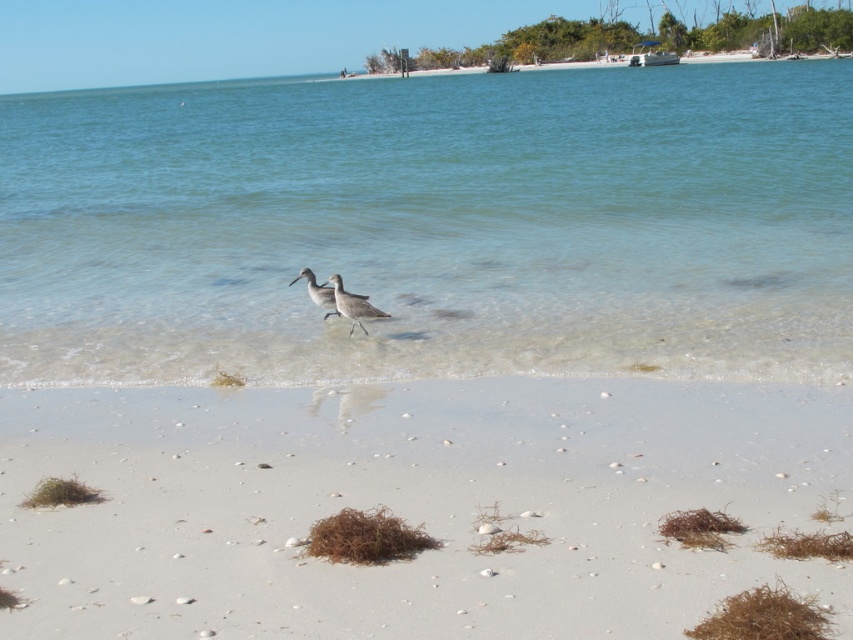
Who is positioned more to the left, brown speckled sandpiper at center or gray matte bird at center?

Positioned to the left is gray matte bird at center.

Which is behind, point (339, 282) or point (332, 301)?

The point (332, 301) is behind.

Is point (351, 314) positioned in front of point (323, 288)?

That is True.

Locate an element on the screen. brown speckled sandpiper at center is located at coordinates (352, 305).

Who is higher up, white sandy beach at lower center or brown speckled sandpiper at center?

Positioned higher is brown speckled sandpiper at center.

Between point (492, 380) and point (338, 305), which one is positioned in front?

Point (492, 380) is in front.

The width and height of the screenshot is (853, 640). I want to click on white sandy beach at lower center, so click(x=412, y=506).

Which is more to the left, clear water at center or gray matte bird at center?

Positioned to the left is clear water at center.

Between point (677, 260) and point (361, 296), which one is positioned behind?

The point (677, 260) is more distant.

The height and width of the screenshot is (640, 853). In order to click on clear water at center in this screenshot , I will do `click(433, 225)`.